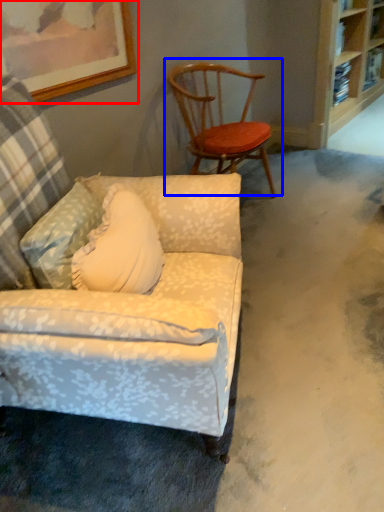
Question: Which object is closer to the camera taking this photo, picture frame (highlighted by a red box) or chair (highlighted by a blue box)?

Choices:
 (A) picture frame
 (B) chair

Answer: (A)